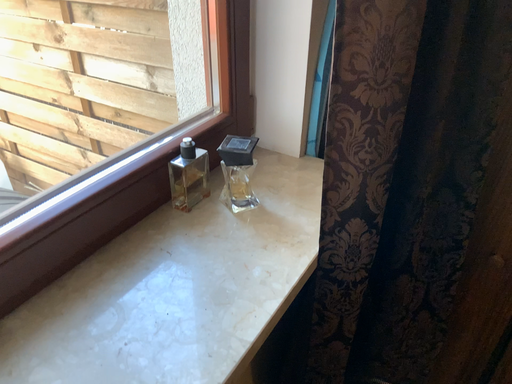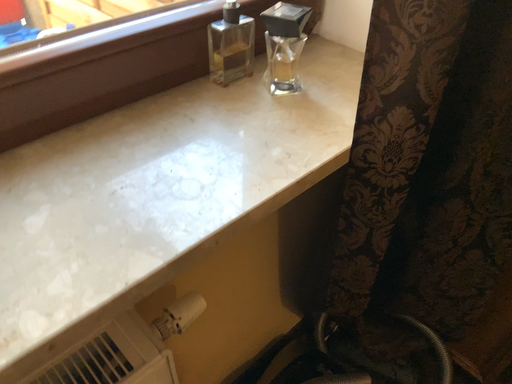
Question: Which way did the camera rotate in the video?

Choices:
 (A) rotated downward
 (B) rotated upward

Answer: (A)